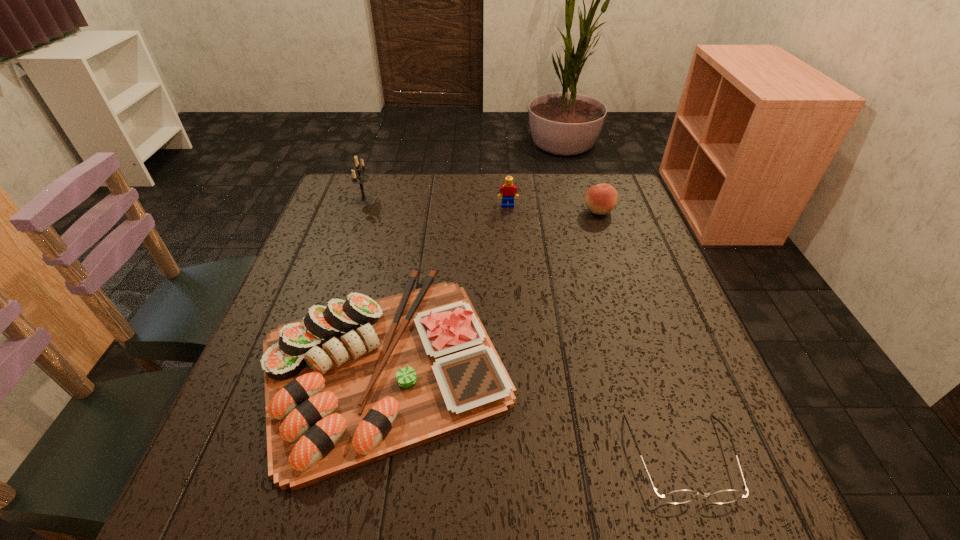
Find the location of a particular element. This screenshot has width=960, height=540. Lego that is at the far edge is located at coordinates click(507, 191).

Locate an element on the screen. The height and width of the screenshot is (540, 960). peach that is at the far edge is located at coordinates (600, 199).

Locate an element on the screen. This screenshot has height=540, width=960. platter that is at the near edge is located at coordinates (351, 383).

Find the location of a particular element. Image resolution: width=960 pixels, height=540 pixels. spectacles located at the near edge is located at coordinates (679, 496).

What are the coordinates of `candle holder that is at the left edge` in the screenshot? It's located at (358, 178).

The width and height of the screenshot is (960, 540). What are the coordinates of `platter that is positioned at the left edge` in the screenshot? It's located at (351, 383).

Locate an element on the screen. This screenshot has height=540, width=960. peach present at the right edge is located at coordinates (600, 199).

Locate an element on the screen. spectacles present at the right edge is located at coordinates (679, 496).

Locate an element on the screen. object located in the far left corner section of the desktop is located at coordinates (358, 178).

Locate an element on the screen. The width and height of the screenshot is (960, 540). object positioned at the near left corner is located at coordinates (351, 383).